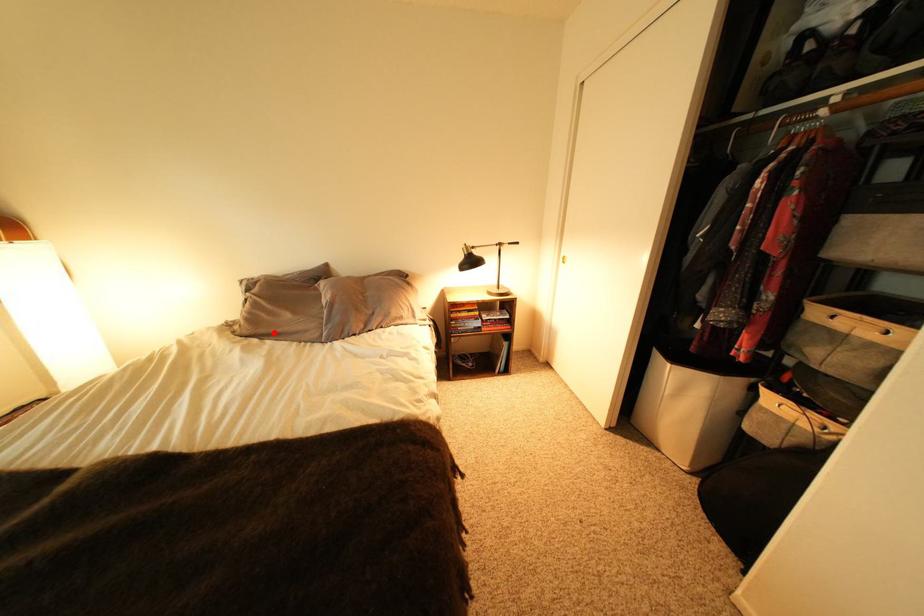
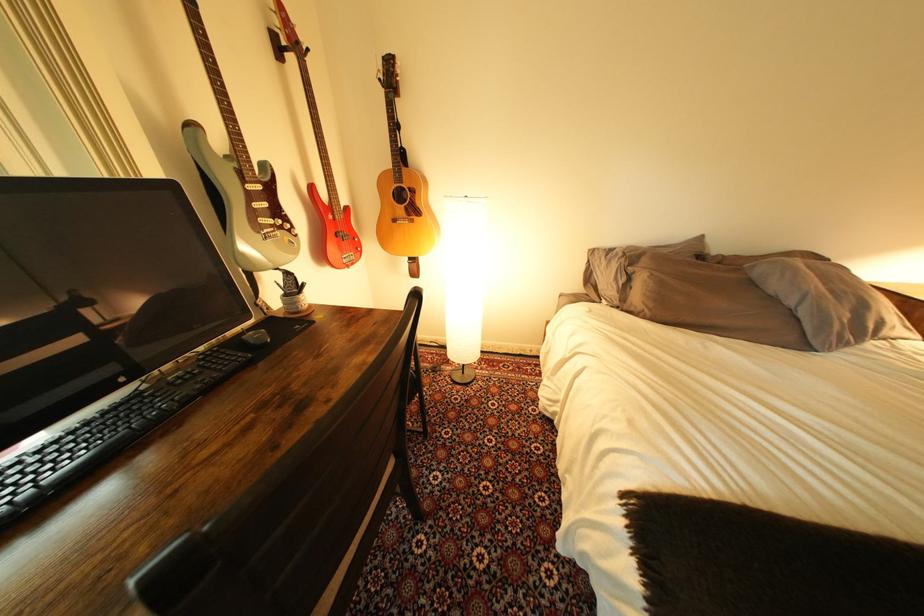
Locate, in the second image, the point that corresponds to the highlighted location in the first image.

(701, 322)